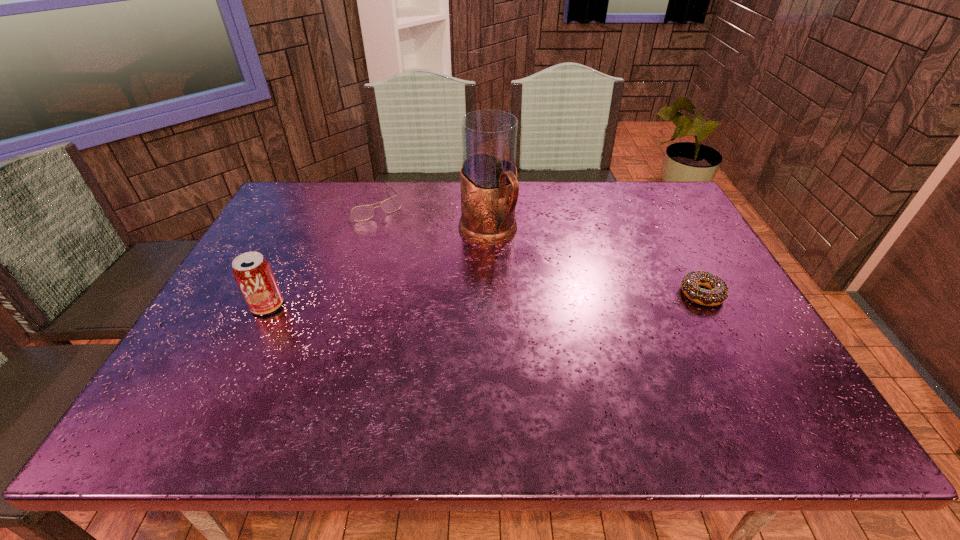
Find the location of `the leftmost object`. the leftmost object is located at coordinates click(253, 274).

I want to click on the second tallest object, so click(x=253, y=274).

Identify the location of the rightmost object. point(690,283).

In order to click on doughnut in this screenshot , I will do `click(690, 283)`.

This screenshot has width=960, height=540. I want to click on the tallest object, so click(488, 177).

You are a GUI agent. You are given a task and a screenshot of the screen. Output one action in this format:
    pyautogui.click(x=<x>, y=<y>)
    Task: Click on the pitcher
    The image size is (960, 540).
    Given the screenshot: What is the action you would take?
    pyautogui.click(x=488, y=177)

At what (x,y) coordinates should I click in order to perform the action: click on the second shortest object. Please return your answer as a coordinate pair (x, y). Looking at the image, I should click on click(360, 213).

The height and width of the screenshot is (540, 960). Identify the location of spectacles. (360, 213).

The width and height of the screenshot is (960, 540). Identify the location of free location located on the right of the third shortest object. (312, 305).

You are a GUI agent. You are given a task and a screenshot of the screen. Output one action in this format:
    pyautogui.click(x=<x>, y=<y>)
    Task: Click on the vacant area located 0.210m on the front of the doughnut
    This screenshot has width=960, height=540.
    Given the screenshot: What is the action you would take?
    pyautogui.click(x=749, y=381)